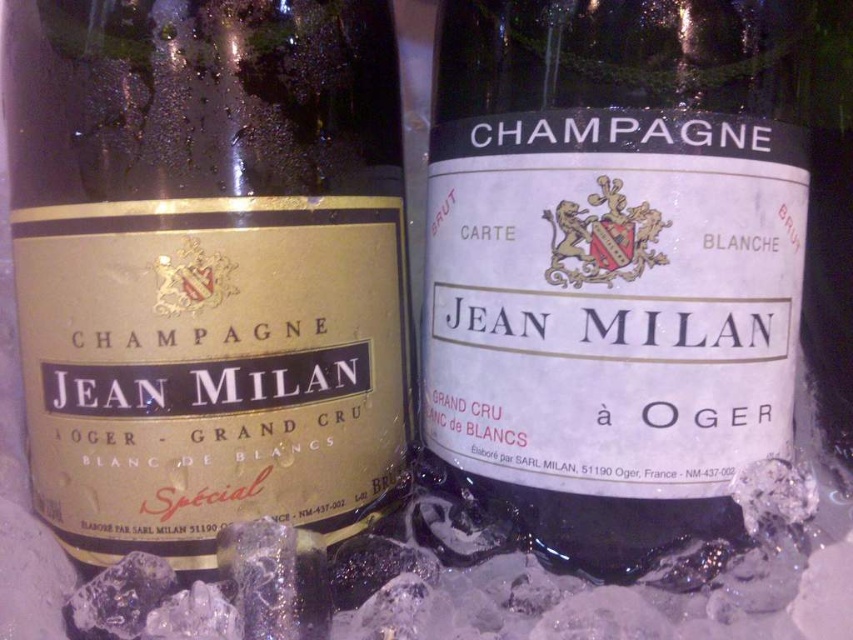
Question: Among these points, which one is nearest to the camera?

Choices:
 (A) (573, 464)
 (B) (323, 490)

Answer: (A)

Question: Where is gold matte champagne bottle at center located in relation to white matte champagne bottle at center in the image?

Choices:
 (A) right
 (B) left

Answer: (B)

Question: Does gold matte champagne bottle at center appear over white matte champagne bottle at center?

Choices:
 (A) no
 (B) yes

Answer: (B)

Question: Which point appears closest to the camera in this image?

Choices:
 (A) (119, 156)
 (B) (512, 106)

Answer: (A)

Question: Considering the relative positions of gold matte champagne bottle at center and white matte champagne bottle at center in the image provided, where is gold matte champagne bottle at center located with respect to white matte champagne bottle at center?

Choices:
 (A) below
 (B) above

Answer: (B)